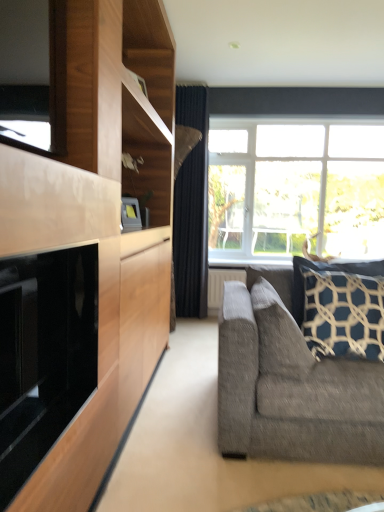
Question: Is dark blue textured pillow at right, which is the second pillow in left-to-right order, next to textured gray couch at right?

Choices:
 (A) yes
 (B) no

Answer: (B)

Question: From the image's perspective, is dark blue textured pillow at right, which is counted as the 1th pillow, starting from the right, located above textured gray couch at right?

Choices:
 (A) no
 (B) yes

Answer: (B)

Question: Can you confirm if dark blue textured pillow at right, which is the second pillow in left-to-right order, is smaller than textured gray couch at right?

Choices:
 (A) yes
 (B) no

Answer: (A)

Question: Considering the relative sizes of dark blue textured pillow at right, which is counted as the 1th pillow, starting from the right, and textured gray couch at right in the image provided, is dark blue textured pillow at right, which is counted as the 1th pillow, starting from the right, thinner than textured gray couch at right?

Choices:
 (A) no
 (B) yes

Answer: (B)

Question: Is dark blue textured pillow at right, which is the second pillow in left-to-right order, far from textured gray couch at right?

Choices:
 (A) no
 (B) yes

Answer: (A)

Question: From the image's perspective, is dark blue textured pillow at right, which is counted as the 1th pillow, starting from the right, under textured gray couch at right?

Choices:
 (A) yes
 (B) no

Answer: (B)

Question: Can you confirm if clear glass window at upper center is smaller than textured gray couch at right?

Choices:
 (A) yes
 (B) no

Answer: (A)

Question: Does clear glass window at upper center have a lesser height compared to textured gray couch at right?

Choices:
 (A) no
 (B) yes

Answer: (A)

Question: From the image's perspective, does clear glass window at upper center appear higher than textured gray couch at right?

Choices:
 (A) no
 (B) yes

Answer: (B)

Question: Is clear glass window at upper center to the right of textured gray couch at right from the viewer's perspective?

Choices:
 (A) yes
 (B) no

Answer: (A)

Question: Is clear glass window at upper center wider than textured gray couch at right?

Choices:
 (A) yes
 (B) no

Answer: (B)

Question: Does clear glass window at upper center turn towards textured gray couch at right?

Choices:
 (A) yes
 (B) no

Answer: (A)

Question: Is clear glass window at upper center to the left of dark blue textured pillow at right, which ranks as the second pillow in right-to-left order, from the viewer's perspective?

Choices:
 (A) no
 (B) yes

Answer: (A)